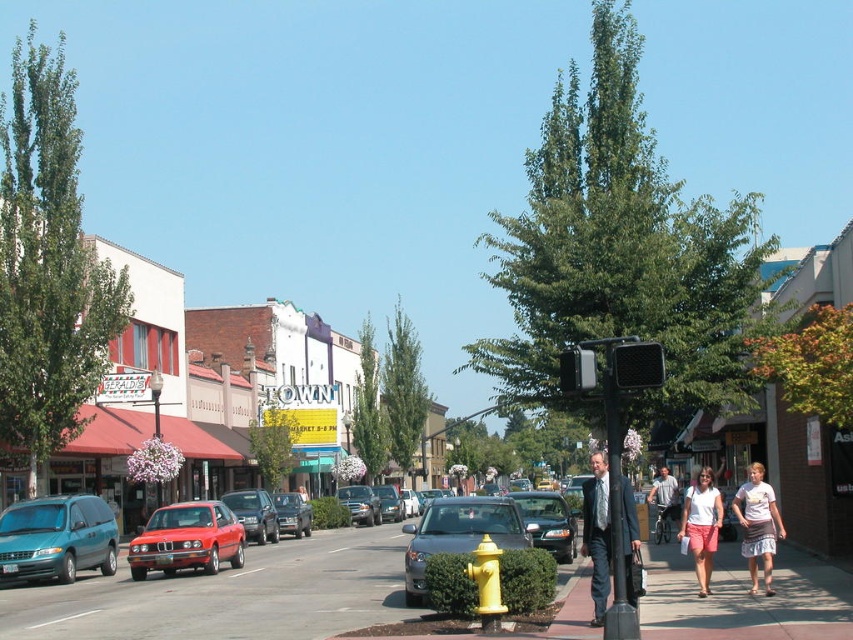
You are a delivery person trying to park your vehicle in a spot between two buildings. The parking spot is at coordinates point 0.8, 0.5. Can the matte black car at center park there?

The matte black car at center is located at point (459,532), which is very close to the desired parking spot at (426,512). However, since the car is already positioned near those coordinates, it might already be occupying or very near the spot. The exact feasibility depends on the parking space dimensions not specified here, but based on proximity, it could potentially fit if there is enough space.

You are standing on the street looking at the buildings. There are two points marked on the buildings, one at point coordinates (663, 500) and another at point coordinates (373, 493). Which point is closer to you?

Point (663, 500) is closer to the camera than point (373, 493).